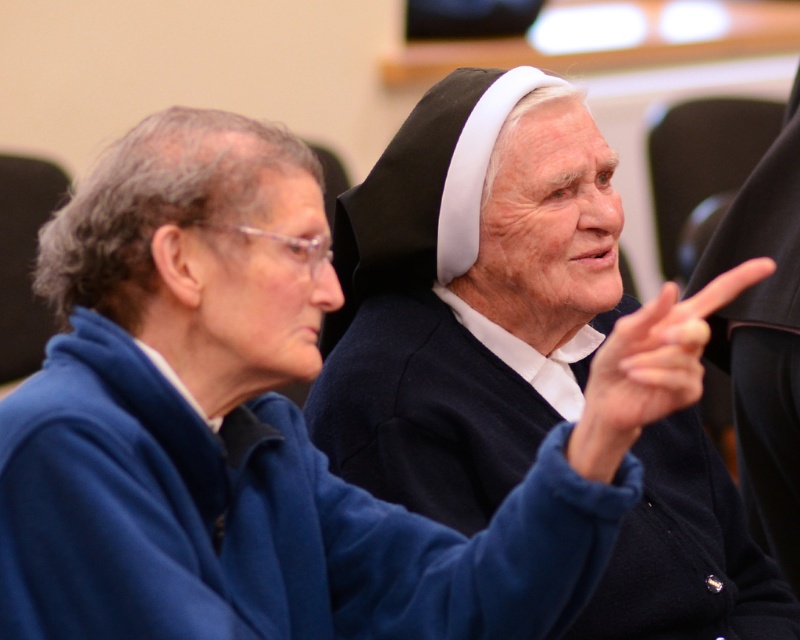
You are a photographer in a conference room. You need to take a photo of the smooth skin finger at center without the blue fleece robe at center blocking it. What should you do?

The blue fleece robe at center is in front of the smooth skin finger at center, so you should move the blue fleece robe at center out of the way or adjust your angle to avoid the robe blocking the finger.

You are attending a meeting in the conference room and notice two points marked on the wall. The first point is at coordinate point (488, 595) and the second is at point (670, 323). If you are facing the wall, which point is closer to the back of the room?

Point (488, 595) is behind point (670, 323), so the point at (488, 595) is closer to the back of the room.